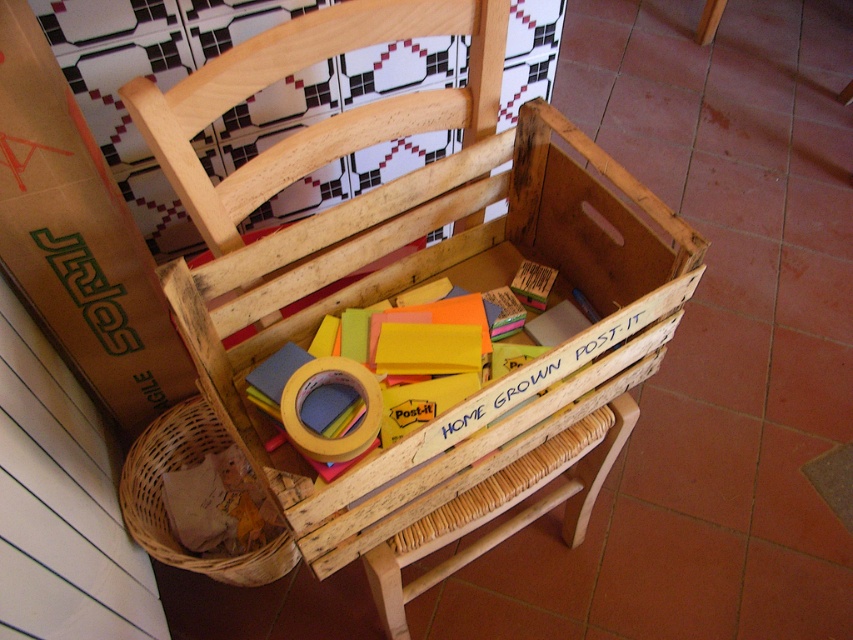
You are organizing the workspace and need to move items from the wooden crate at center to the woven brown basket at lower left. Which direction should you move the items to place them into the basket?

The wooden crate at center is positioned on the right side of the woven brown basket at lower left, so you should move the items to the left to place them into the basket.

In the scene shown: You are organizing the storage area and need to place a new item between the wooden crate at center and the woven brown basket at lower left. Can you fit it there?

The wooden crate at center is above the woven brown basket at lower left, so there is no space between them for placing a new item.

You need to stack the woven brown basket at lower left on top of the wooden crate at center. Is this possible without the basket falling off?

The wooden crate at center is much taller than the woven brown basket at lower left, so stacking the basket on top would likely be stable as the basket is smaller and the crate provides a sturdy base.